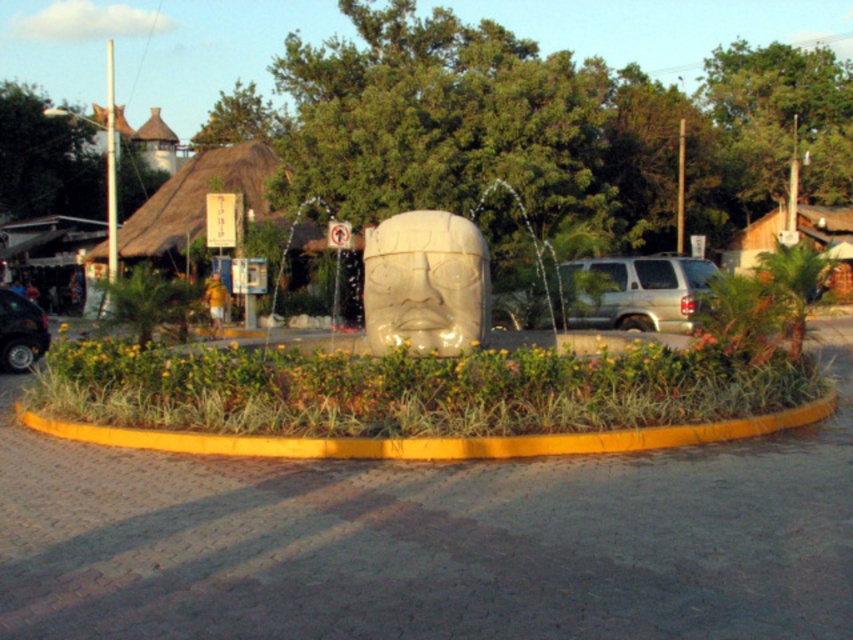
Question: Estimate the real-world distances between objects in this image. Which object is closer to the shiny black car at lower left?

Choices:
 (A) silver metallic suv at right
 (B) yellow painted curb at lower center

Answer: (A)

Question: Considering the relative positions of silver metallic suv at right and shiny black car at lower left in the image provided, where is silver metallic suv at right located with respect to shiny black car at lower left?

Choices:
 (A) below
 (B) above

Answer: (B)

Question: Is yellow painted curb at lower center wider than shiny black car at lower left?

Choices:
 (A) no
 (B) yes

Answer: (A)

Question: Estimate the real-world distances between objects in this image. Which object is farther from the yellow painted curb at lower center?

Choices:
 (A) silver metallic suv at right
 (B) shiny black car at lower left

Answer: (B)

Question: Among these points, which one is nearest to the camera?

Choices:
 (A) (625, 328)
 (B) (178, 442)
 (C) (19, 332)

Answer: (B)

Question: Can you confirm if yellow painted curb at lower center is positioned to the left of shiny black car at lower left?

Choices:
 (A) yes
 (B) no

Answer: (B)